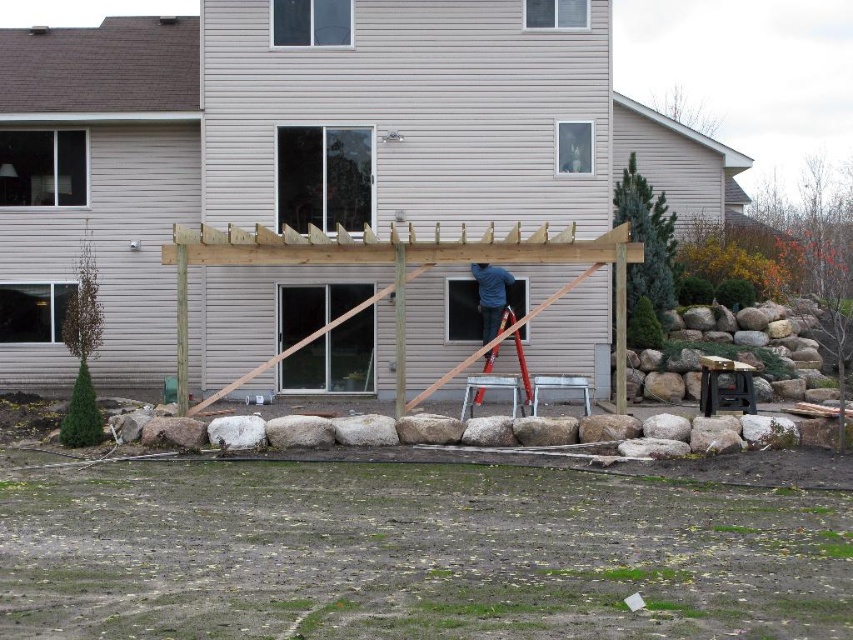
Question: Which object is the closest to the natural wood pergola at center?

Choices:
 (A) metallic silver ladder at center
 (B) dark blue shirt at center

Answer: (B)

Question: Estimate the real-world distances between objects in this image. Which object is closer to the dark blue shirt at center?

Choices:
 (A) natural wood pergola at center
 (B) metallic silver ladder at center

Answer: (B)

Question: Is dark blue shirt at center to the left of metallic silver ladder at center from the viewer's perspective?

Choices:
 (A) yes
 (B) no

Answer: (A)

Question: Is natural wood pergola at center closer to camera compared to metallic silver ladder at center?

Choices:
 (A) yes
 (B) no

Answer: (B)

Question: Does dark blue shirt at center appear over metallic silver ladder at center?

Choices:
 (A) yes
 (B) no

Answer: (A)

Question: Which point appears farthest from the camera in this image?

Choices:
 (A) (518, 356)
 (B) (212, 120)
 (C) (496, 323)

Answer: (B)